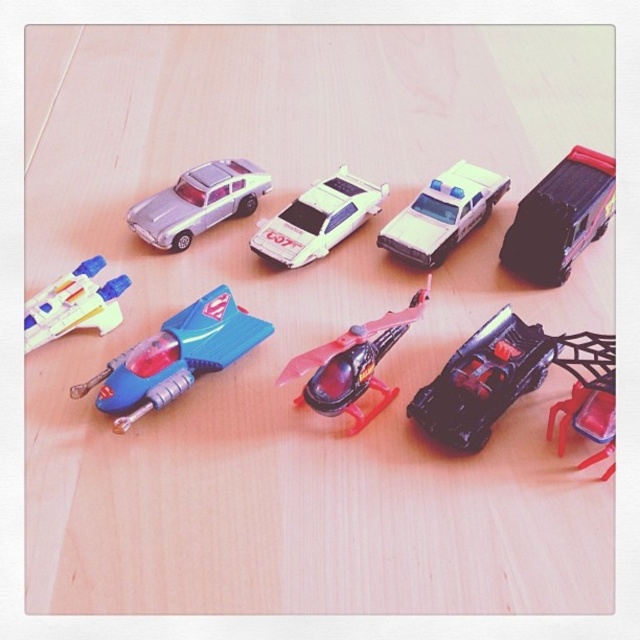
Question: Which object is the farthest from the blue plastic spaceship at center-left?

Choices:
 (A) black plastic toy car at center-right
 (B) white glossy police car at center
 (C) matte blue plastic spaceship at upper left

Answer: (B)

Question: Among these points, which one is farthest from the camera?

Choices:
 (A) (246, 186)
 (B) (573, 353)
 (C) (212, 337)

Answer: (A)

Question: Does metallic silver car at upper left appear over matte blue plastic spaceship at upper left?

Choices:
 (A) no
 (B) yes

Answer: (B)

Question: Among these objects, which one is nearest to the camera?

Choices:
 (A) white glossy car at center
 (B) black plastic truck at upper right

Answer: (B)

Question: Can you confirm if shiny black helicopter at center is wider than matte blue plastic spaceship at upper left?

Choices:
 (A) no
 (B) yes

Answer: (B)

Question: Is black plastic truck at upper right wider than matte blue plastic spaceship at upper left?

Choices:
 (A) yes
 (B) no

Answer: (A)